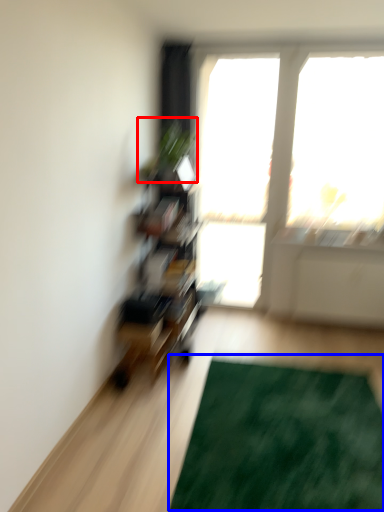
Question: Among these objects, which one is nearest to the camera, plant (highlighted by a red box) or doormat (highlighted by a blue box)?

Choices:
 (A) plant
 (B) doormat

Answer: (B)